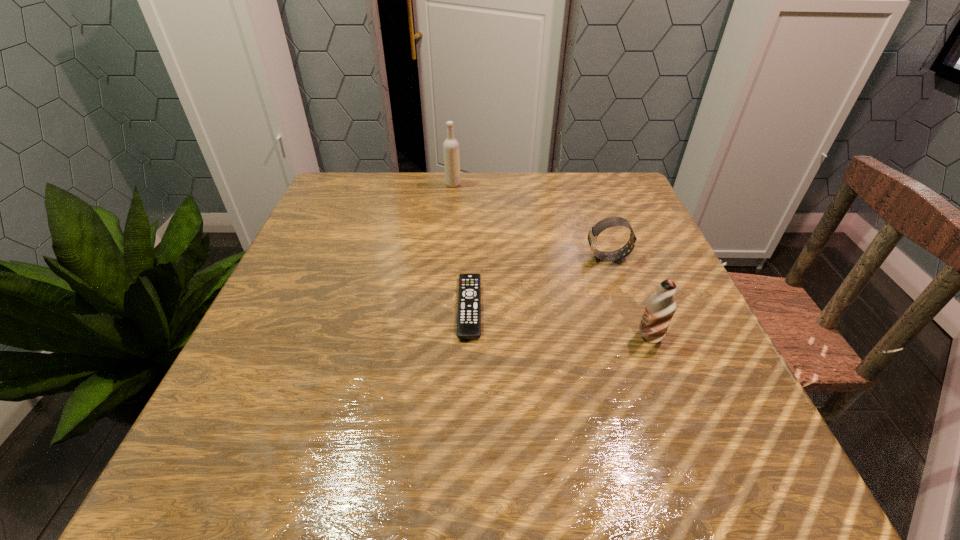
You are a GUI agent. You are given a task and a screenshot of the screen. Output one action in this format:
    pyautogui.click(x=<x>, y=<y>)
    Task: Click on the empty space that is in between the remote control and the second tallest object
    The height and width of the screenshot is (540, 960).
    Given the screenshot: What is the action you would take?
    pyautogui.click(x=560, y=322)

You are a GUI agent. You are given a task and a screenshot of the screen. Output one action in this format:
    pyautogui.click(x=<x>, y=<y>)
    Task: Click on the free spot between the chocolate milk and the leftmost object
    
    Given the screenshot: What is the action you would take?
    pyautogui.click(x=551, y=261)

Choose which object is the nearest neighbor to the watch. Please provide its 2D coordinates. Your answer should be formatted as a tuple, i.e. [(x, y)], where the tuple contains the x and y coordinates of a point satisfying the conditions above.

[(660, 307)]

Image resolution: width=960 pixels, height=540 pixels. In order to click on the closest object to the vodka in this screenshot , I will do (x=469, y=296).

This screenshot has height=540, width=960. What are the coordinates of `vacant space that satisfies the following two spatial constraints: 1. on the face of the second shortest object; 2. on the back side of the second tallest object` in the screenshot? It's located at (636, 336).

Identify the location of vacant space that satisfies the following two spatial constraints: 1. on the face of the watch; 2. on the left side of the third shortest object. (636, 336).

Find the location of `free space that satisfies the following two spatial constraints: 1. on the back side of the chocolate milk; 2. on the face of the second shortest object`. free space that satisfies the following two spatial constraints: 1. on the back side of the chocolate milk; 2. on the face of the second shortest object is located at coordinates (619, 258).